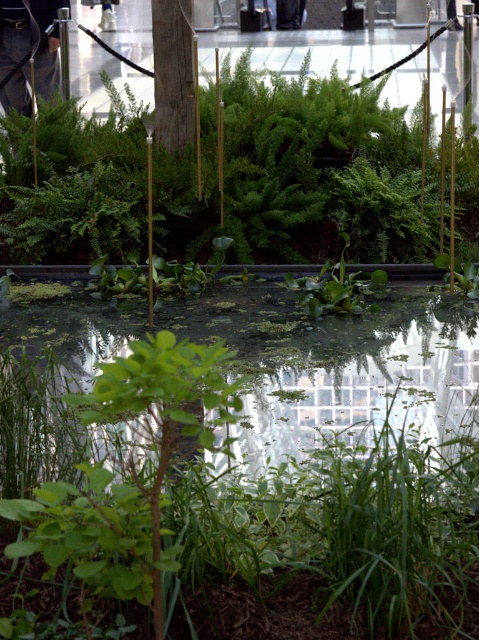
You are navigating through the indoor garden and want to reach a specific point. You are currently at point [192,333]. There is another point at [353,125]. Which point is further away from your current position?

Point [353,125] is behind point [192,333], so it is further away from your current position.

You are a gardener planning to place a new decorative statue between the green leafy plant at upper center and the green leafy plant at center. Based on their widths, which plant should the statue be placed closer to ensure it doesn

The green leafy plant at upper center might be wider than the green leafy plant at center, so the statue should be placed closer to the green leafy plant at upper center to account for its greater width.